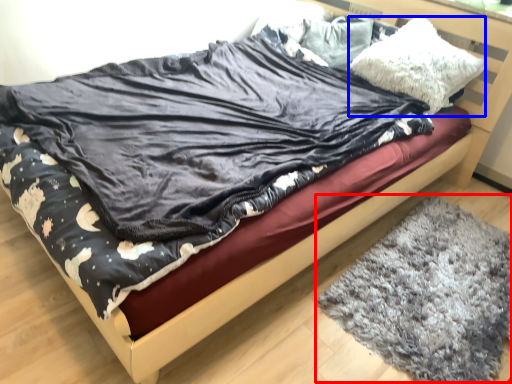
Question: Among these objects, which one is farthest to the camera, mat (highlighted by a red box) or pillow (highlighted by a blue box)?

Choices:
 (A) mat
 (B) pillow

Answer: (B)